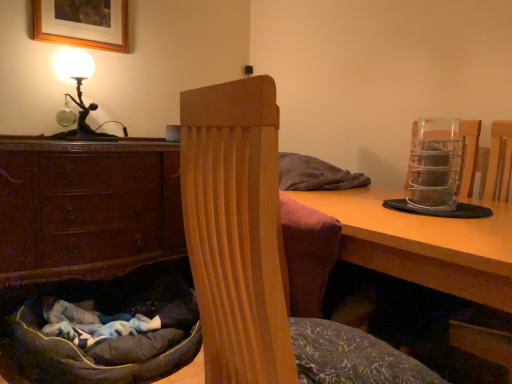
Question: Can you confirm if brown wood chest of drawers at lower left is positioned to the left of wooden table at center?

Choices:
 (A) no
 (B) yes

Answer: (B)

Question: From the image's perspective, would you say brown wood chest of drawers at lower left is shown under wooden table at center?

Choices:
 (A) no
 (B) yes

Answer: (A)

Question: Is brown wood chest of drawers at lower left far away from wooden table at center?

Choices:
 (A) yes
 (B) no

Answer: (A)

Question: Does brown wood chest of drawers at lower left have a lesser height compared to wooden table at center?

Choices:
 (A) no
 (B) yes

Answer: (A)

Question: From the image's perspective, is brown wood chest of drawers at lower left on top of wooden table at center?

Choices:
 (A) no
 (B) yes

Answer: (B)

Question: Is wooden table at center located within brown wood chest of drawers at lower left?

Choices:
 (A) no
 (B) yes

Answer: (A)

Question: Does dark gray plush bean bag chair at lower left, the second bean bag chair positioned from the front, come behind wooden table at center?

Choices:
 (A) no
 (B) yes

Answer: (B)

Question: Is dark gray plush bean bag chair at lower left, acting as the second bean bag chair starting from the right, in front of wooden table at center?

Choices:
 (A) yes
 (B) no

Answer: (B)

Question: Is wooden table at center at the back of dark gray plush bean bag chair at lower left, acting as the second bean bag chair starting from the right?

Choices:
 (A) yes
 (B) no

Answer: (B)

Question: Does dark gray plush bean bag chair at lower left, acting as the first bean bag chair starting from the left, have a lesser height compared to wooden table at center?

Choices:
 (A) no
 (B) yes

Answer: (B)

Question: From the image's perspective, is dark gray plush bean bag chair at lower left, the second bean bag chair positioned from the front, on top of wooden table at center?

Choices:
 (A) yes
 (B) no

Answer: (B)

Question: Considering the relative sizes of brown wood chest of drawers at lower left and metallic wire mesh at right in the image provided, is brown wood chest of drawers at lower left thinner than metallic wire mesh at right?

Choices:
 (A) yes
 (B) no

Answer: (B)